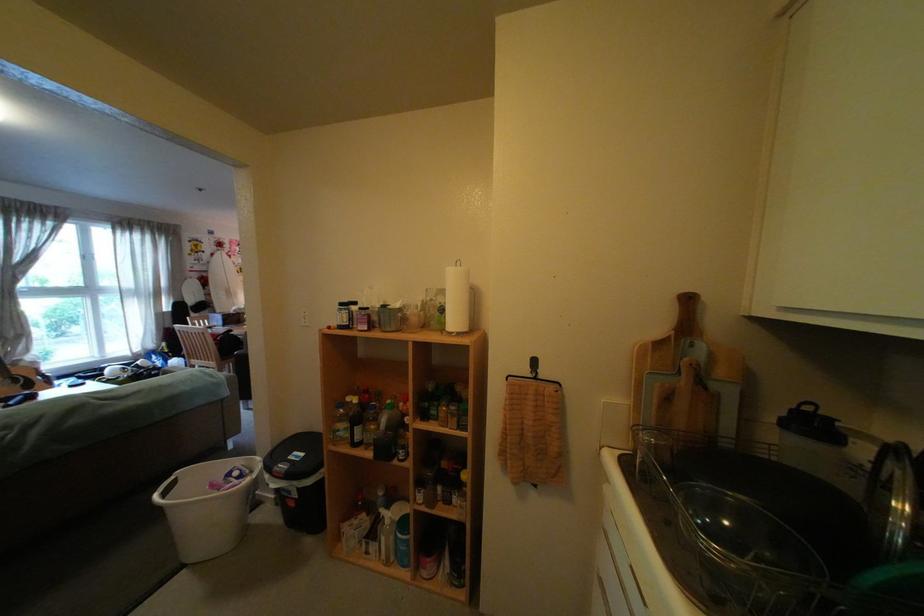
Find where to lift the knife holder handle. Please return your answer as a coordinate pair (x, y).

(687, 379)